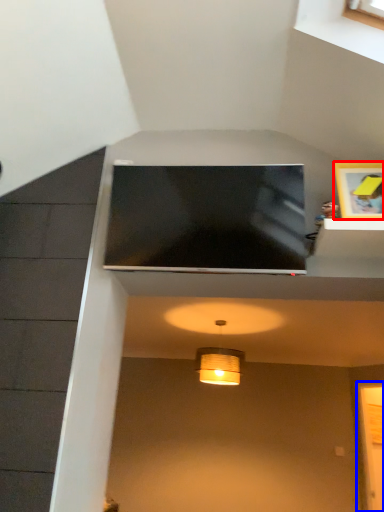
Question: Which object is closer to the camera taking this photo, picture frame (highlighted by a red box) or glass door (highlighted by a blue box)?

Choices:
 (A) picture frame
 (B) glass door

Answer: (A)